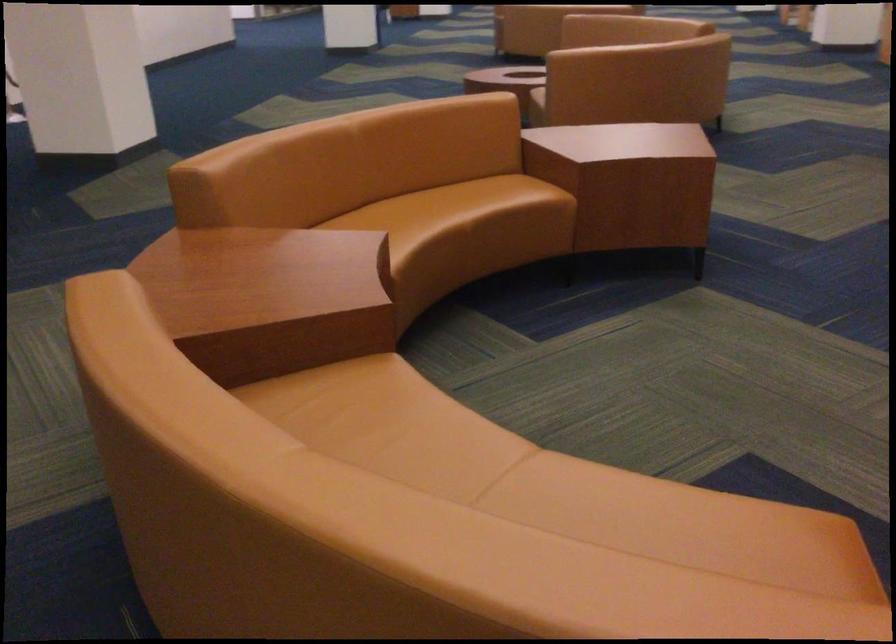
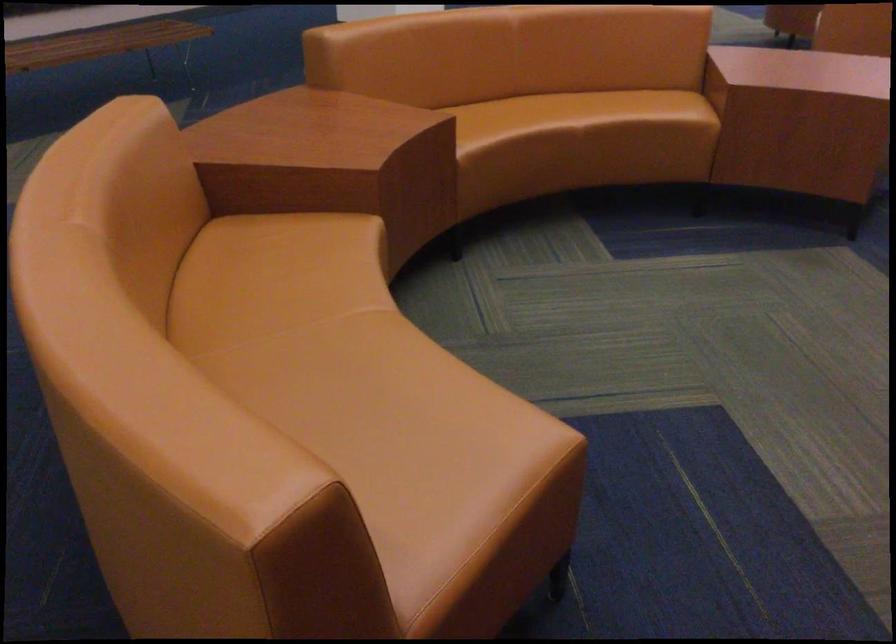
In the second image, find the point that corresponds to [265,301] in the first image.

(297, 151)